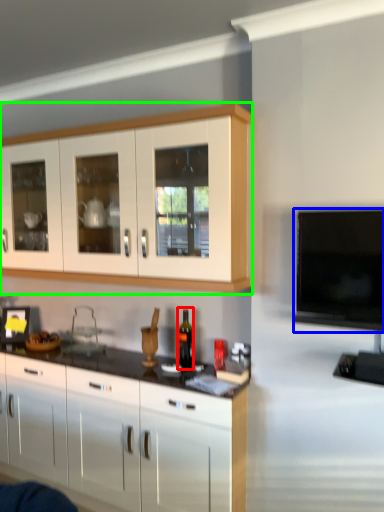
Question: Which object is positioned closest to bottle (highlighted by a red box)? Select from television (highlighted by a blue box) and cabinetry (highlighted by a green box).

Choices:
 (A) television
 (B) cabinetry

Answer: (B)